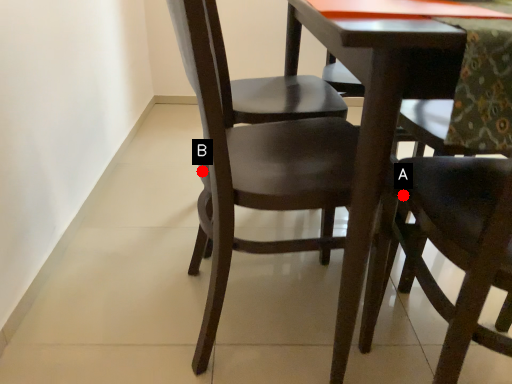
Question: Two points are circled on the image, labeled by A and B beside each circle. Among these points, which one is farthest from the camera?

Choices:
 (A) A is further
 (B) B is further

Answer: (B)